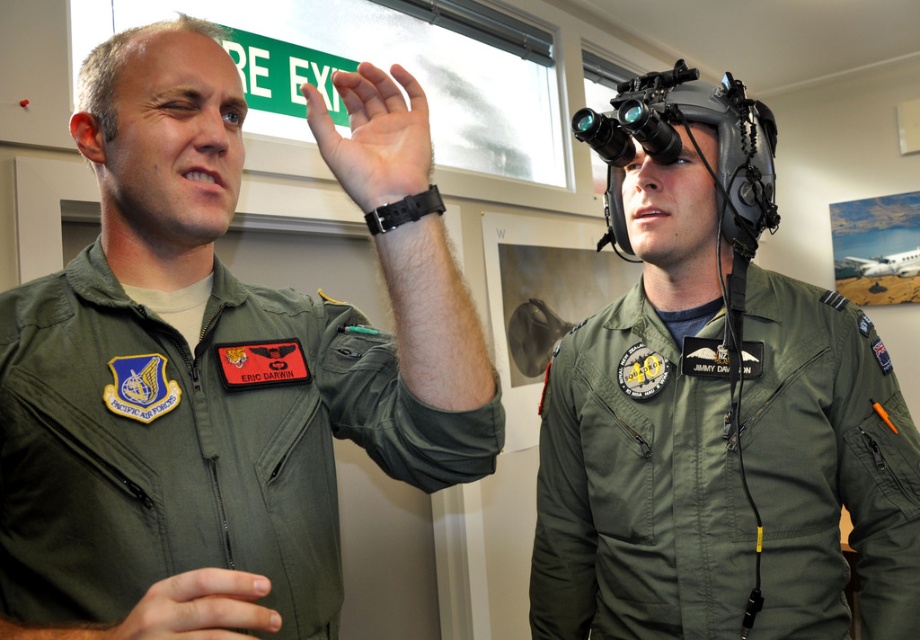
Question: Which of these objects is positioned farthest from the skinny black watch at upper center?

Choices:
 (A) skinny flesh at lower left
 (B) matte gray helmet at center
 (C) green matte uniform at upper left

Answer: (B)

Question: Where is green matte uniform at upper left located in relation to skinny flesh at lower left in the image?

Choices:
 (A) below
 (B) above

Answer: (B)

Question: Is green matte uniform at upper left positioned in front of matte gray helmet at center?

Choices:
 (A) yes
 (B) no

Answer: (A)

Question: Does matte gray helmet at center appear under skinny flesh at lower left?

Choices:
 (A) no
 (B) yes

Answer: (A)

Question: Which point is closer to the camera taking this photo?

Choices:
 (A) click(338, 348)
 (B) click(250, 605)
 (C) click(769, 211)

Answer: (B)

Question: Which object appears closest to the camera in this image?

Choices:
 (A) green matte uniform at upper left
 (B) matte green helmet at upper center
 (C) skinny black watch at upper center
 (D) skinny flesh at lower left

Answer: (D)